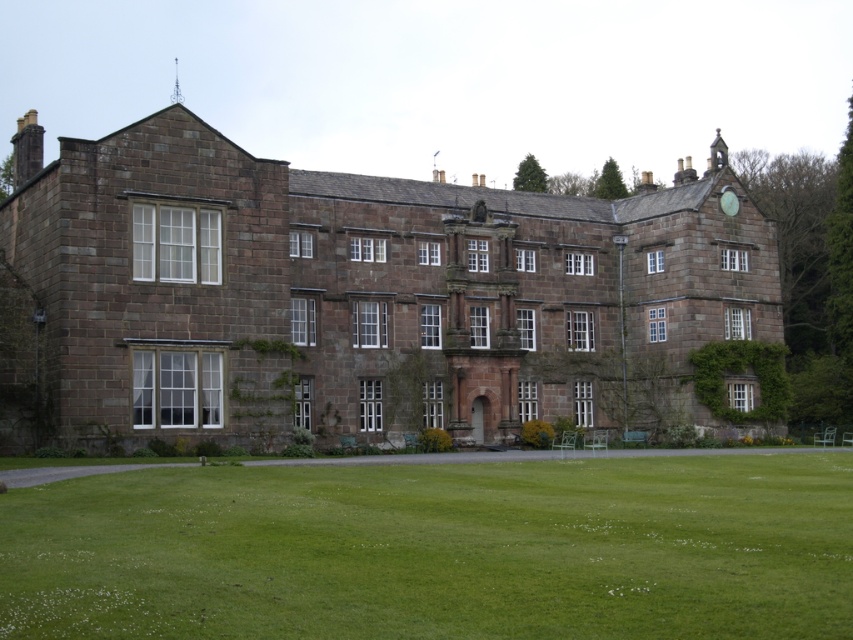
Between brown stone mansion at center and green grass at lower center, which one is positioned lower?

Positioned lower is green grass at lower center.

Does brown stone mansion at center have a lesser width compared to green grass at lower center?

Incorrect, brown stone mansion at center's width is not less than green grass at lower center's.

This screenshot has width=853, height=640. Identify the location of brown stone mansion at center. point(361,294).

Locate an element on the screen. This screenshot has height=640, width=853. brown stone mansion at center is located at coordinates (361, 294).